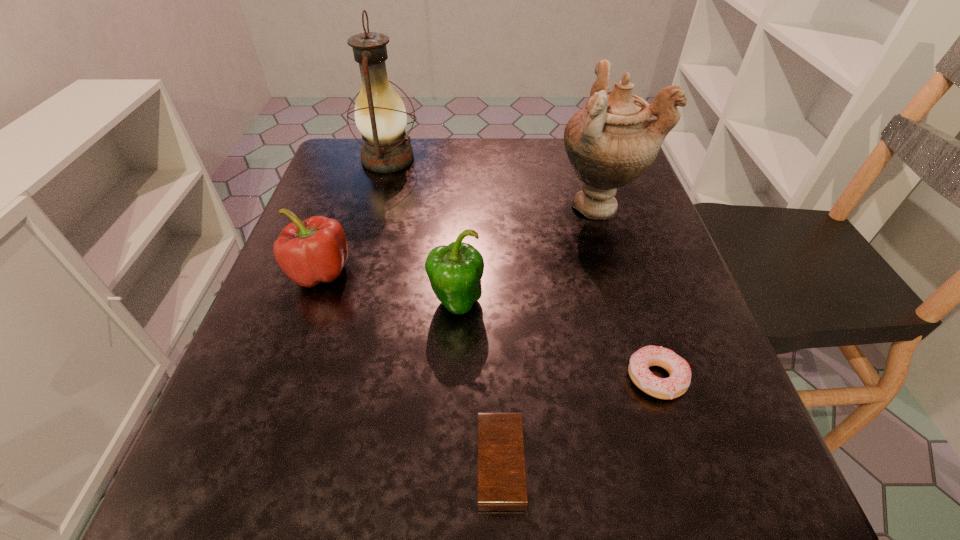
This screenshot has height=540, width=960. In order to click on unoccupied position between the second tallest object and the right bell pepper in this screenshot , I will do `click(528, 254)`.

The width and height of the screenshot is (960, 540). Identify the location of the second closest object to the fifth farthest object. (455, 271).

Where is `object that is the fifth closest to the shortest object`? The height and width of the screenshot is (540, 960). object that is the fifth closest to the shortest object is located at coordinates (380, 115).

Where is `blank area in the image that satisfies the following two spatial constraints: 1. on the front side of the fifth tallest object; 2. on the left side of the fourth tallest object`? This screenshot has height=540, width=960. blank area in the image that satisfies the following two spatial constraints: 1. on the front side of the fifth tallest object; 2. on the left side of the fourth tallest object is located at coordinates (282, 379).

I want to click on vacant region that satisfies the following two spatial constraints: 1. on the front side of the taller bell pepper; 2. on the left side of the shorter bell pepper, so click(x=309, y=303).